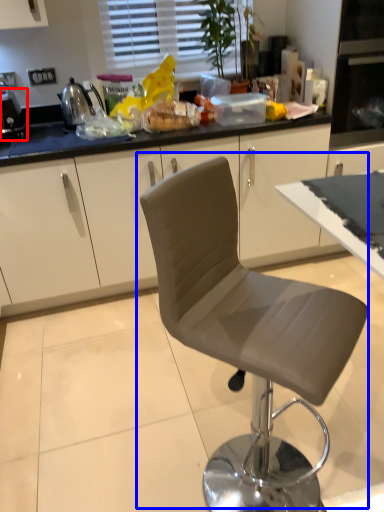
Question: Among these objects, which one is farthest to the camera, appliance (highlighted by a red box) or chair (highlighted by a blue box)?

Choices:
 (A) appliance
 (B) chair

Answer: (A)